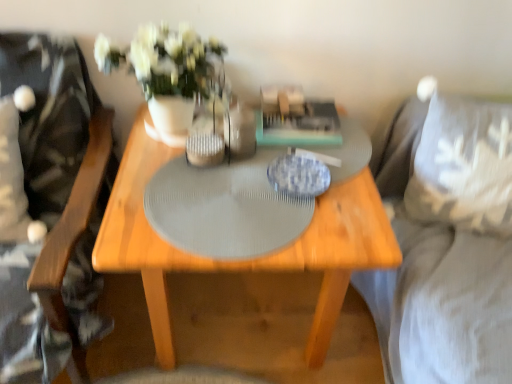
Image resolution: width=512 pixels, height=384 pixels. Find the location of `vacant area that is in front of white ceramic vase at center`. vacant area that is in front of white ceramic vase at center is located at coordinates (176, 172).